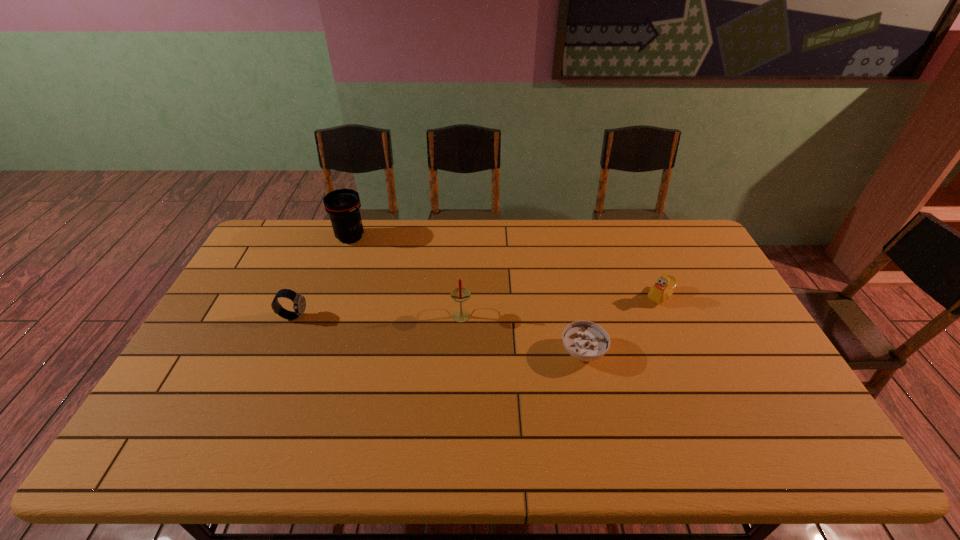
Image resolution: width=960 pixels, height=540 pixels. Identify the location of vacant region located 0.130m at the beak of the duck. (604, 296).

Locate an element on the screen. vacant space located at the beak of the duck is located at coordinates (629, 296).

Image resolution: width=960 pixels, height=540 pixels. I want to click on blank space located 0.310m on the back of the nearest object, so click(564, 265).

The height and width of the screenshot is (540, 960). In order to click on object that is at the far edge in this screenshot , I will do 342,205.

Where is `vacant space at the far edge of the desktop`? The width and height of the screenshot is (960, 540). vacant space at the far edge of the desktop is located at coordinates (529, 247).

Identify the location of free region at the near edge. (580, 450).

In the image, there is a desktop. Identify the location of free space at the left edge. (219, 318).

At what (x,y) coordinates should I click in order to perform the action: click on free space at the right edge of the desktop. Please return your answer as a coordinate pair (x, y). Looking at the image, I should click on (788, 426).

At what (x,y) coordinates should I click in order to perform the action: click on free space at the far left corner. Please return your answer as a coordinate pair (x, y). This screenshot has width=960, height=540. Looking at the image, I should click on (270, 254).

The image size is (960, 540). What are the coordinates of `blank region between the watch and the fourth object from left to right` in the screenshot? It's located at (438, 334).